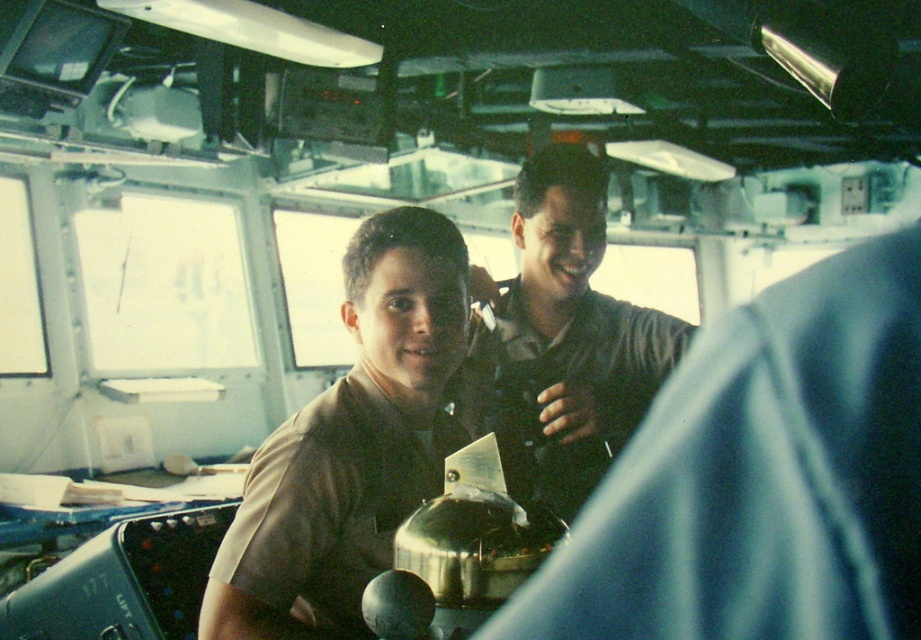
You are a maintenance technician standing 1.5 meters away from the camera in the ship bridge. You need to reach the brown uniform at center to fix a malfunction. Can you reach it without moving closer?

The brown uniform at center is 1.24 meters away from the camera. Since you are 1.5 meters away from the camera, you are 0.26 meters farther than the required distance. Therefore, you cannot reach the brown uniform at center without moving closer.

You are a crew member on the ship and need to quickly identify the position of the two individuals at the navigational station. Which individual is closer to you, the observer, between the matte brown shirt at center and the dark brown uniform at center?

The matte brown shirt at center is closer to you because the dark brown uniform at center is positioned behind it.